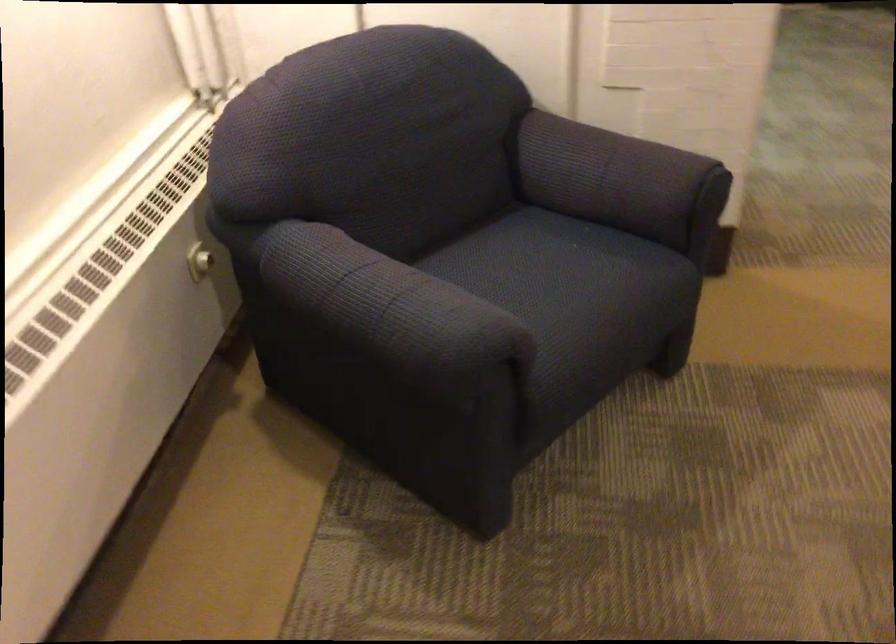
Question: The first image is from the beginning of the video and the second image is from the end. How did the camera likely rotate when shooting the video?

Choices:
 (A) Left
 (B) Right
 (C) Up
 (D) Down

Answer: (B)